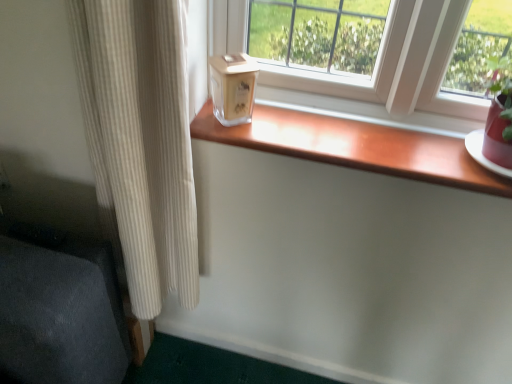
Where is `vacant area that is in front of clear glass candle at center`? vacant area that is in front of clear glass candle at center is located at coordinates (229, 132).